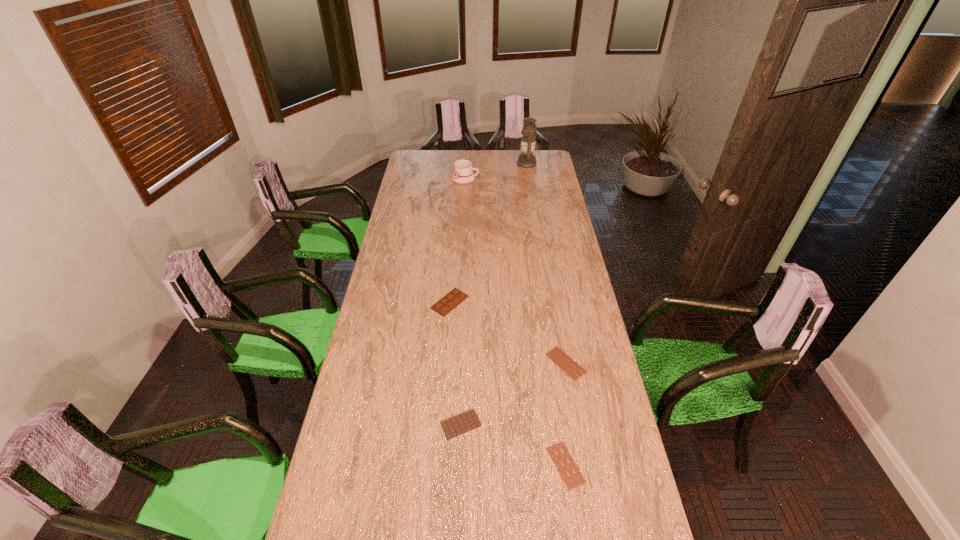
Find the location of `the tallest object`. the tallest object is located at coordinates (528, 143).

This screenshot has width=960, height=540. Identify the location of the farthest object. (528, 143).

Locate an element on the screen. This screenshot has height=540, width=960. mug is located at coordinates (463, 173).

Locate an element on the screen. The width and height of the screenshot is (960, 540). the fifth shortest object is located at coordinates (463, 173).

Find the location of a particular element. This screenshot has width=960, height=540. the fourth shortest object is located at coordinates (455, 297).

The width and height of the screenshot is (960, 540). Identify the location of the farthest chocolate bar. (455, 297).

Where is `the third shortest chocolate bar`? the third shortest chocolate bar is located at coordinates (467, 421).

Find the location of a particular element. the second nearest object is located at coordinates (467, 421).

You are a GUI agent. You are given a task and a screenshot of the screen. Output one action in this format:
    pyautogui.click(x=<x>, y=<y>)
    Task: Click on the third nearest chocolate bar
    The image size is (960, 540).
    Given the screenshot: What is the action you would take?
    pyautogui.click(x=560, y=358)

The width and height of the screenshot is (960, 540). In order to click on the nearest object in this screenshot , I will do `click(570, 473)`.